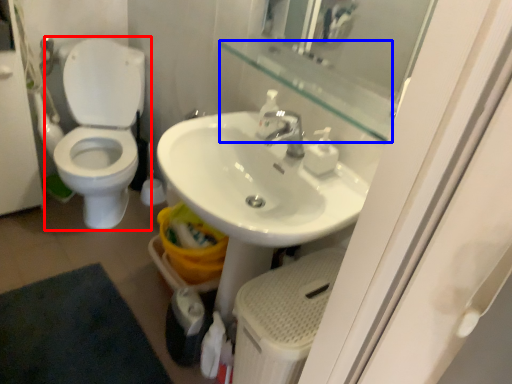
Question: Which point is further to the camera, toilet (highlighted by a red box) or balustrade (highlighted by a blue box)?

Choices:
 (A) toilet
 (B) balustrade

Answer: (A)